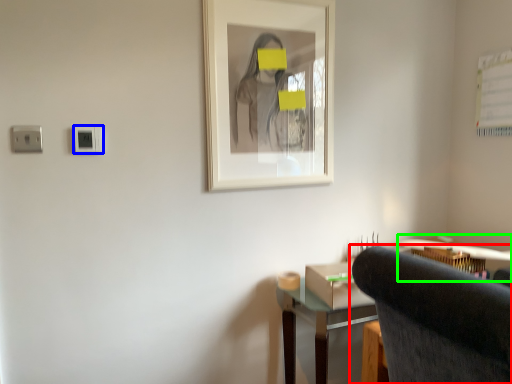
Question: Based on their relative distances, which object is farther from chair (highlighted by a red box)? Choose from electric outlet (highlighted by a blue box) and computer desk (highlighted by a green box).

Choices:
 (A) electric outlet
 (B) computer desk

Answer: (A)